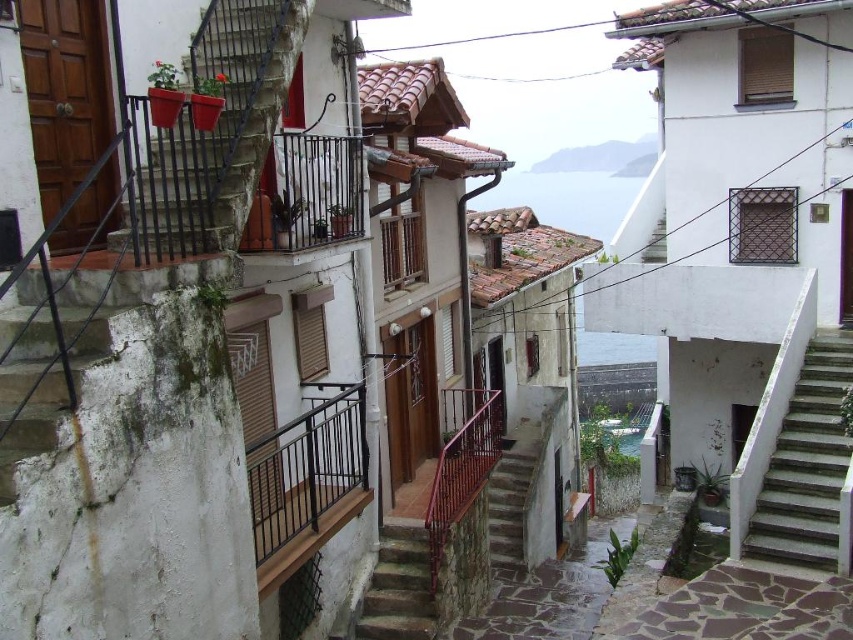
Question: Based on their relative distances, which object is farther from the metallic red railing at center?

Choices:
 (A) black metal railing at center
 (B) white concrete stairs at upper center
 (C) concrete stairs at center

Answer: (B)

Question: Can you confirm if rustic wood stairs at upper left is wider than concrete stairs at center?

Choices:
 (A) yes
 (B) no

Answer: (A)

Question: Which object is positioned closest to the stone textured stairs at center?

Choices:
 (A) concrete stairs at center
 (B) black metal railing at center
 (C) rustic wood stairs at upper left
 (D) smooth stone cliff at upper center

Answer: (B)

Question: Does stone textured stairs at center lie in front of white concrete stairs at upper center?

Choices:
 (A) no
 (B) yes

Answer: (B)

Question: Is smooth concrete stairs at left below white concrete stairs at upper center?

Choices:
 (A) yes
 (B) no

Answer: (A)

Question: Which object is positioned farthest from the black metal railing at center?

Choices:
 (A) concrete stairs at right
 (B) concrete stairs at center

Answer: (A)